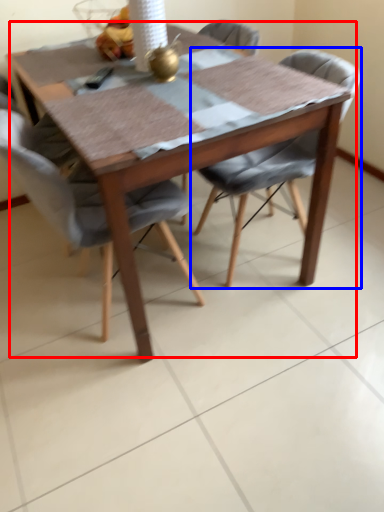
Question: Which object appears closest to the camera in this image, kitchen & dining room table (highlighted by a red box) or chair (highlighted by a blue box)?

Choices:
 (A) kitchen & dining room table
 (B) chair

Answer: (A)